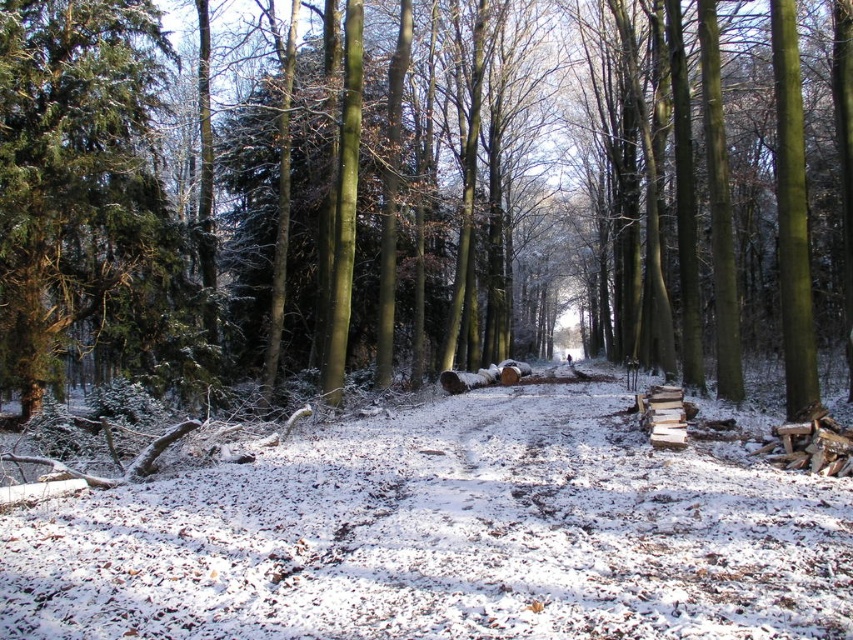
Is the position of white snow-covered path at center less distant than that of green textured evergreen tree at left?

Yes, white snow-covered path at center is in front of green textured evergreen tree at left.

Between point (186, 625) and point (73, 321), which one is positioned in front?

Positioned in front is point (186, 625).

Image resolution: width=853 pixels, height=640 pixels. I want to click on white snow-covered path at center, so click(445, 536).

Does point (592, 282) lie behind point (699, 570)?

Yes.

Which is behind, point (497, 216) or point (177, 477)?

The point (497, 216) is more distant.

This screenshot has width=853, height=640. Find the location of `green matte tree at center`. green matte tree at center is located at coordinates [x=428, y=195].

Can you confirm if green matte tree at center is shorter than green textured evergreen tree at left?

No.

Which is in front, point (62, 56) or point (44, 243)?

Point (44, 243)

Find the location of `green matte tree at center`. green matte tree at center is located at coordinates (428, 195).